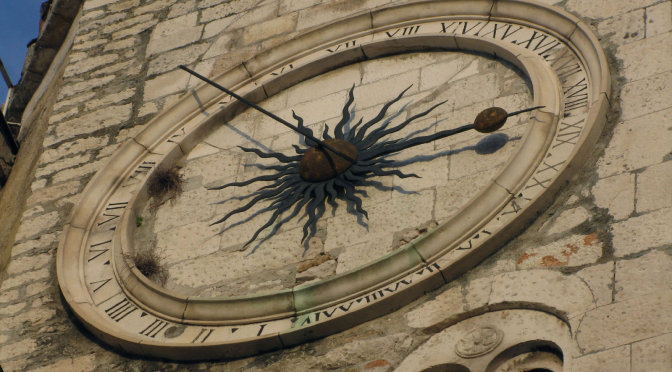
Locate an element on the screen. The height and width of the screenshot is (372, 672). wall under clock is located at coordinates (237, 365).